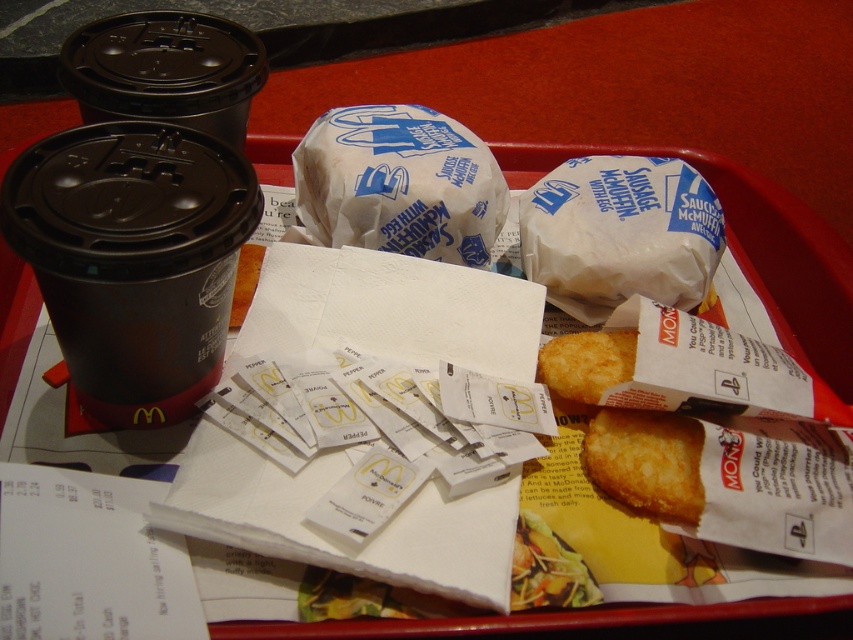
Question: Which of the following is the closest to the observer?

Choices:
 (A) (625, 360)
 (B) (85, 403)
 (C) (476, 156)

Answer: (B)

Question: Is black paper cup at left in front of white paper wrapped burger at center?

Choices:
 (A) yes
 (B) no

Answer: (A)

Question: Based on their relative distances, which object is farther from the black paper cup at left?

Choices:
 (A) yellow paper packet at center
 (B) white paper wrapped burger at center
 (C) golden crispy nugget at lower right
 (D) white paper wrapped sausage muffin at center

Answer: (D)

Question: Does black paper cup at left appear on the right side of white paper wrapped burger at center?

Choices:
 (A) no
 (B) yes

Answer: (A)

Question: Can you confirm if white paper wrapped burger at center is thinner than golden crispy nugget at lower right?

Choices:
 (A) yes
 (B) no

Answer: (B)

Question: Which point is farther from the camera taking this photo?

Choices:
 (A) (556, 220)
 (B) (614, 337)
 (C) (461, 198)

Answer: (A)